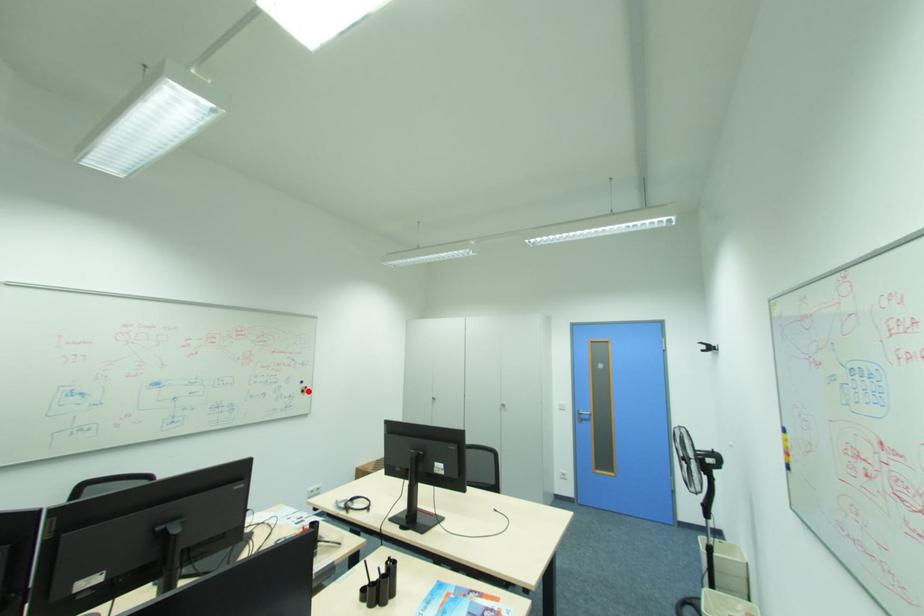
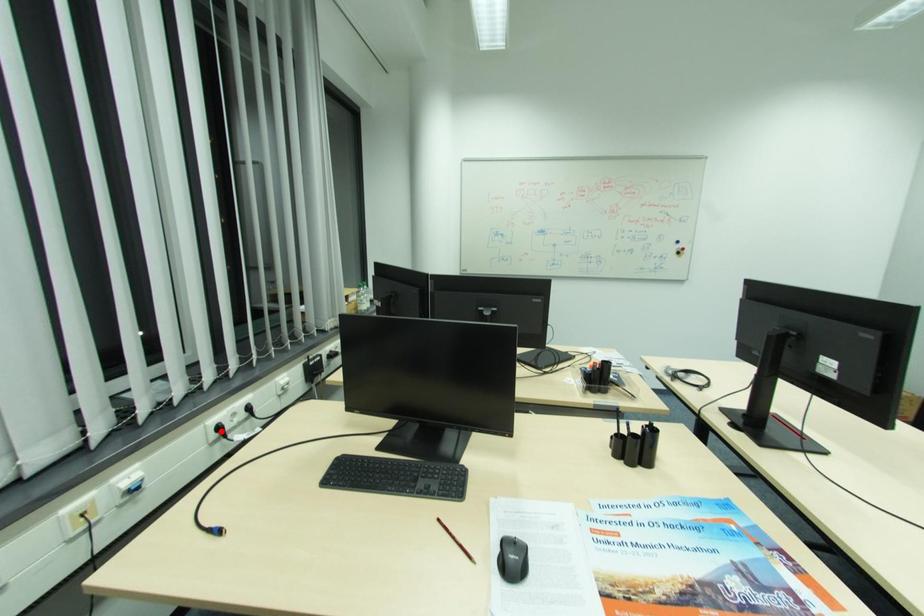
I am providing you with two images of the same scene from different viewpoints. A red point is marked on the first image and another point is marked on the second image. Is the marked point in image1 the same physical position as the marked point in image2?

No